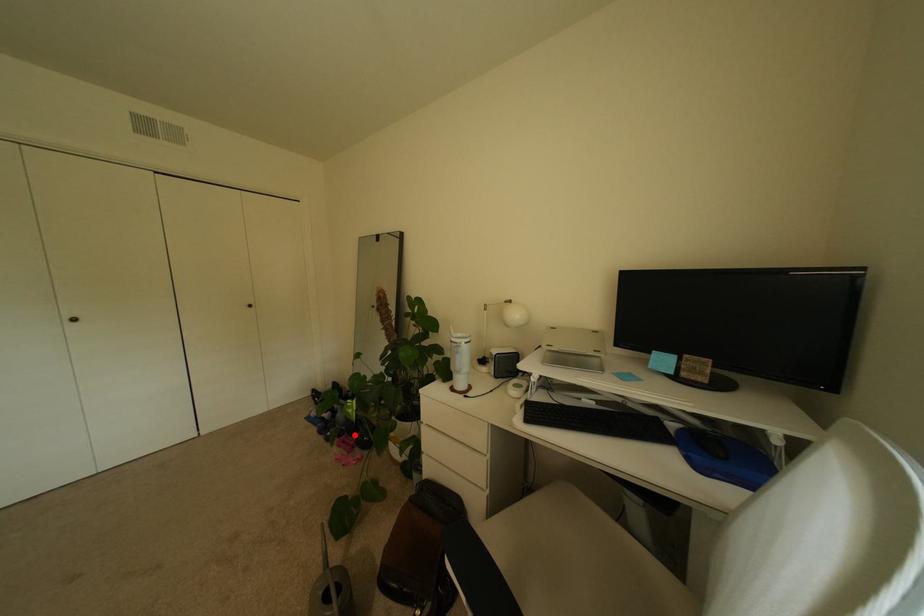
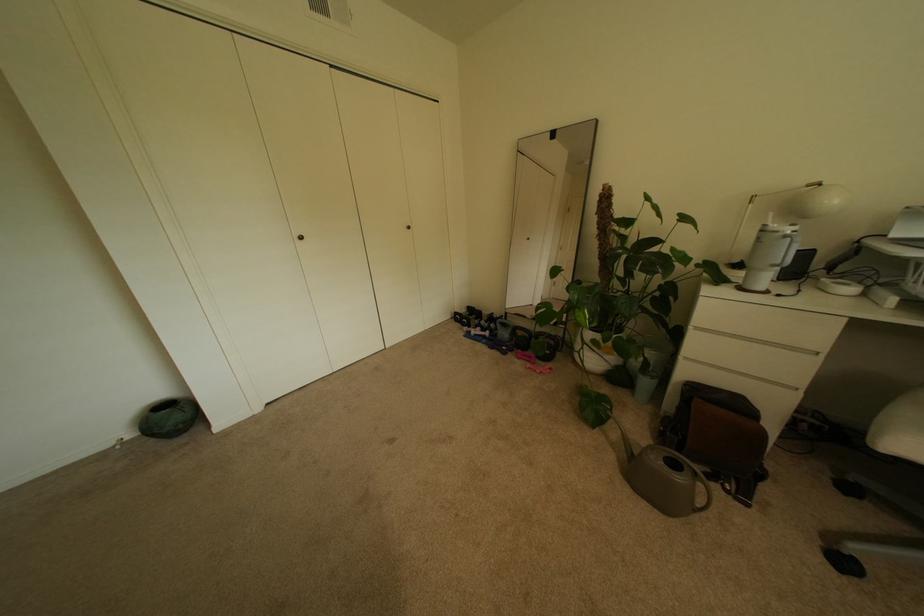
Question: I am providing you with two images of the same scene from different viewpoints. A red point is shown in image1. For the corresponding object point in image2, is it positioned nearer or farther from the camera?

Choices:
 (A) Nearer
 (B) Farther

Answer: (A)